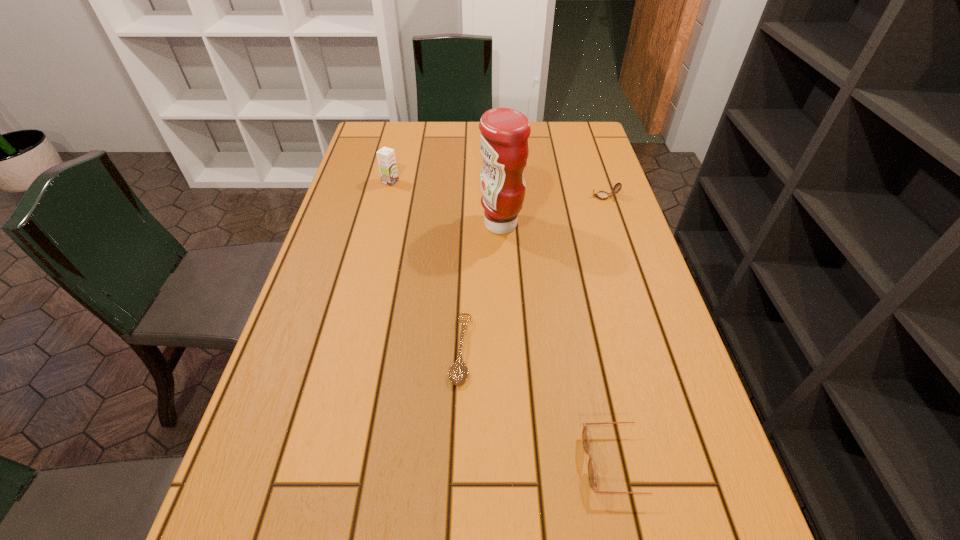
This screenshot has width=960, height=540. In order to click on vacant space positioned on the left of the third object from right to left in this screenshot , I will do `click(407, 225)`.

This screenshot has width=960, height=540. Identify the location of vacant region located 0.080m on the front of the farthest object. (385, 203).

Where is `vacant space located on the face of the compass`? Image resolution: width=960 pixels, height=540 pixels. vacant space located on the face of the compass is located at coordinates (509, 197).

Identify the location of free space located on the face of the compass. (502, 197).

You are a GUI agent. You are given a task and a screenshot of the screen. Output one action in this format:
    pyautogui.click(x=<x>, y=<y>)
    Task: Click on the free space located on the face of the compass
    Image resolution: width=960 pixels, height=540 pixels.
    Given the screenshot: What is the action you would take?
    pyautogui.click(x=506, y=197)

At what (x,y) coordinates should I click in order to perform the action: click on vacant space located on the front-facing side of the sunglasses. Please return your answer as a coordinate pair (x, y). Looking at the image, I should click on (477, 462).

Identify the location of free space located on the front-facing side of the sunglasses. (363, 462).

This screenshot has width=960, height=540. In order to click on vacant space located on the front-facing side of the sunglasses in this screenshot , I will do `click(459, 462)`.

Identify the location of free space located 0.230m on the front of the shortest object. The height and width of the screenshot is (540, 960). (454, 524).

What are the coordinates of `object located at the left edge` in the screenshot? It's located at (386, 157).